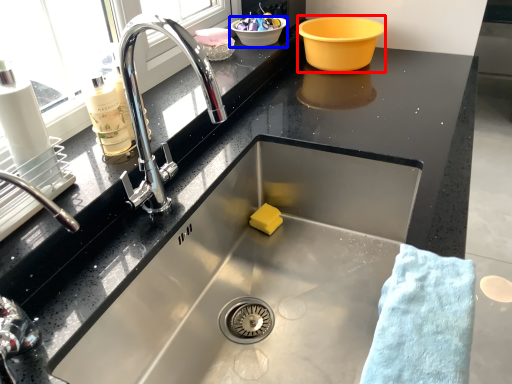
Question: Which point is closer to the camera, basin (highlighted by a red box) or basin (highlighted by a blue box)?

Choices:
 (A) basin
 (B) basin

Answer: (A)